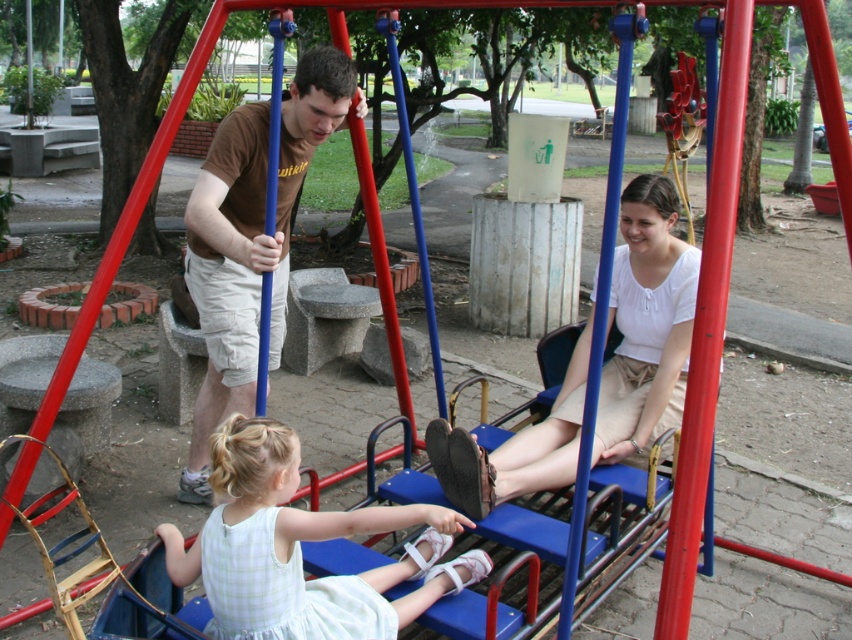
Is white matte shirt at center to the right of brown cotton shirt at center from the viewer's perspective?

Indeed, white matte shirt at center is positioned on the right side of brown cotton shirt at center.

In the scene shown: Who is more forward, (682,324) or (245,218)?

Point (682,324) is in front.

Identify the location of white matte shirt at center. This screenshot has width=852, height=640. (646, 323).

Between white satin dress at lower center and white matte shirt at center, which one has more height?

Standing taller between the two is white matte shirt at center.

Is white satin dress at lower center bigger than white matte shirt at center?

Actually, white satin dress at lower center might be smaller than white matte shirt at center.

Measure the distance between point (360, 595) and camera.

They are 2.45 meters apart.

You are a GUI agent. You are given a task and a screenshot of the screen. Output one action in this format:
    pyautogui.click(x=<x>, y=<y>)
    Task: Click on the white satin dress at lower center
    The height and width of the screenshot is (640, 852).
    Given the screenshot: What is the action you would take?
    pyautogui.click(x=298, y=548)

Is white satin dress at lower center further to camera compared to brown cotton shirt at center?

A: No, white satin dress at lower center is in front of brown cotton shirt at center.

Which is in front, point (250, 600) or point (283, 195)?

Point (250, 600)

At what (x,y) coordinates should I click in order to perform the action: click on white satin dress at lower center. Please return your answer as a coordinate pair (x, y). The height and width of the screenshot is (640, 852). Looking at the image, I should click on (298, 548).